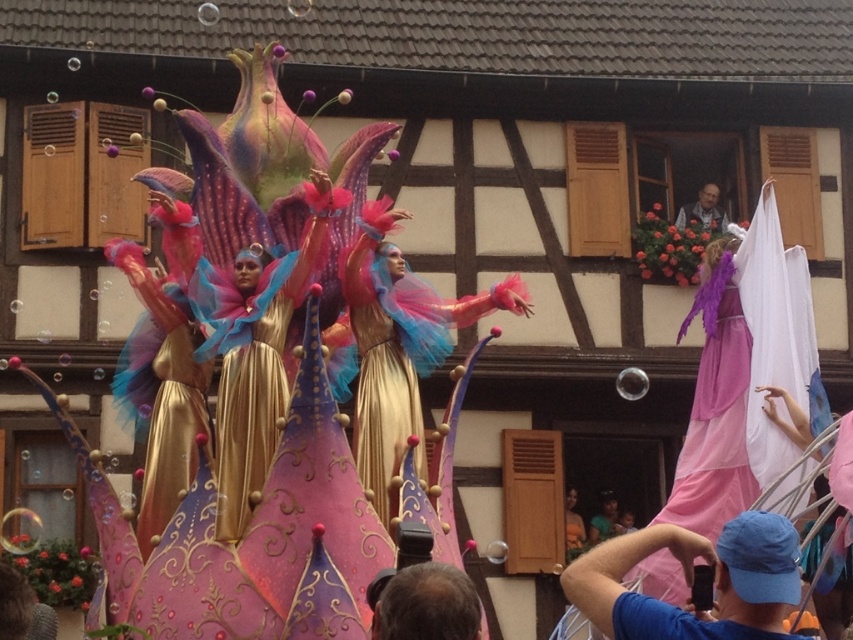
You are standing in the middle of a lively parade and see the shiny gold dress at center. If you want to take a closer look, how many steps do you need to take to reach it? Assume each step covers approximately 3 feet.

The shiny gold dress at center is 175.47 feet away from the viewer. To reach it, you would need to take approximately 58.5 steps, since 175.47 divided by 3 equals about 58.5 steps.

You are a photographer at the parade and want to capture both the shiny gold dress at center and the pink satin dress at right in a single frame. Given their sizes, which dress will appear larger in your photo?

The shiny gold dress at center will appear larger in the photo because it is bigger than the pink satin dress at right.